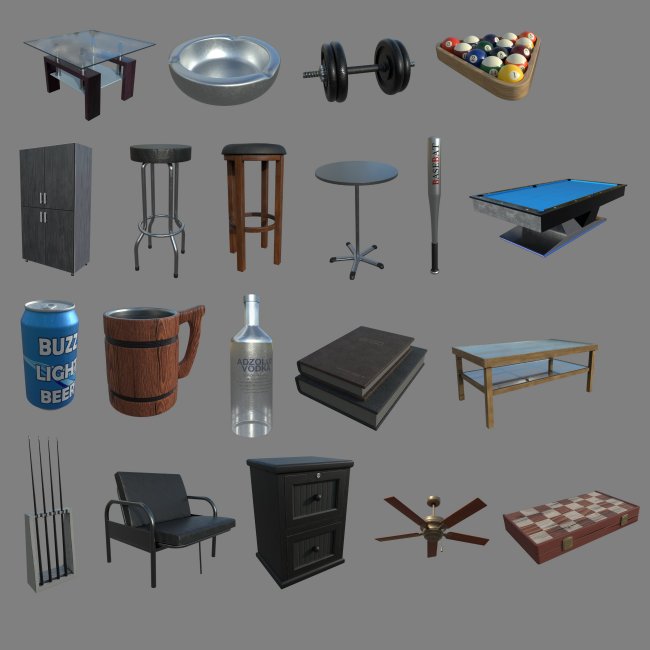
I want to click on cabinet door handles, so click(x=40, y=222), click(x=44, y=222), click(x=45, y=202), click(x=39, y=200).